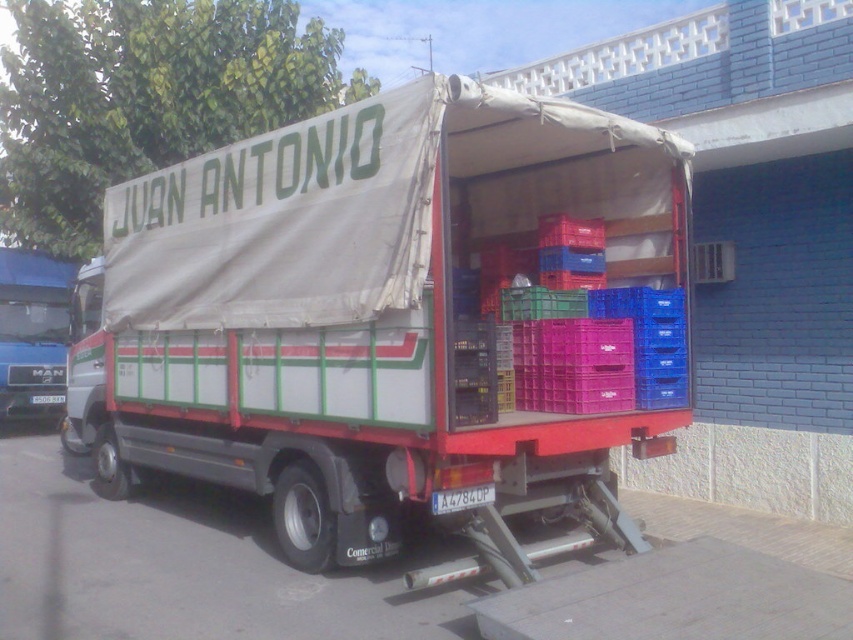
You are standing at the delivery truck and looking towards the building. There are two points marked on the ground near the truck. The first point is at coordinates point (x=262, y=394) and the second point is at point (x=32, y=406). Which point is closer to the building?

Point (x=262, y=394) is in front of point (x=32, y=406), so the first point is closer to the building.

You are a delivery person standing 5 meters away from the white canvas truck at center. Can you safely walk up to the truck without needing to step over any obstacles?

The distance of white canvas truck at center from camera is 4.28 meters. Since you are standing 5 meters away, you can safely walk up to the truck without needing to step over any obstacles as the distance is within a manageable range.

You are a delivery person who needs to access the white canvas truck at center and the blue metallic truck at left. Which truck is closer to the ground?

The white canvas truck at center is located below the blue metallic truck at left, so it is closer to the ground.